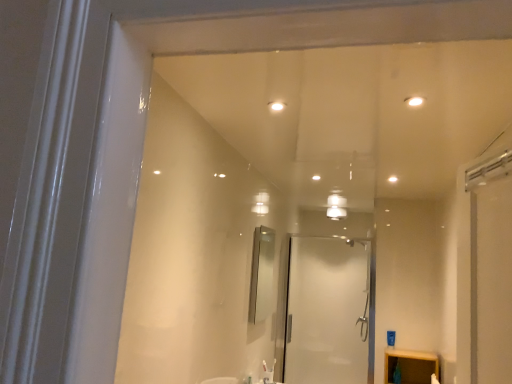
Question: Can you confirm if silver metallic mirror at center is positioned to the right of transparent glass shower door at center?

Choices:
 (A) yes
 (B) no

Answer: (B)

Question: Considering the relative positions of silver metallic mirror at center and transparent glass shower door at center in the image provided, is silver metallic mirror at center behind transparent glass shower door at center?

Choices:
 (A) no
 (B) yes

Answer: (A)

Question: Considering the relative sizes of silver metallic mirror at center and transparent glass shower door at center in the image provided, is silver metallic mirror at center smaller than transparent glass shower door at center?

Choices:
 (A) yes
 (B) no

Answer: (A)

Question: Could you tell me if silver metallic mirror at center is turned towards transparent glass shower door at center?

Choices:
 (A) no
 (B) yes

Answer: (A)

Question: From the image's perspective, does silver metallic mirror at center appear higher than transparent glass shower door at center?

Choices:
 (A) yes
 (B) no

Answer: (A)

Question: From the image's perspective, is silver metallic mirror at center under transparent glass shower door at center?

Choices:
 (A) yes
 (B) no

Answer: (B)

Question: Does transparent glass shower door at center appear on the right side of silver metallic mirror at center?

Choices:
 (A) yes
 (B) no

Answer: (A)

Question: Is transparent glass shower door at center behind silver metallic mirror at center?

Choices:
 (A) no
 (B) yes

Answer: (B)

Question: Would you say transparent glass shower door at center is a long distance from silver metallic mirror at center?

Choices:
 (A) yes
 (B) no

Answer: (A)

Question: Is transparent glass shower door at center shorter than silver metallic mirror at center?

Choices:
 (A) yes
 (B) no

Answer: (B)

Question: Would you say silver metallic mirror at center is part of transparent glass shower door at center's contents?

Choices:
 (A) no
 (B) yes

Answer: (A)

Question: Is transparent glass shower door at center smaller than silver metallic mirror at center?

Choices:
 (A) no
 (B) yes

Answer: (A)

Question: Considering their positions, is silver metallic mirror at center located in front of or behind transparent glass shower door at center?

Choices:
 (A) behind
 (B) front

Answer: (B)